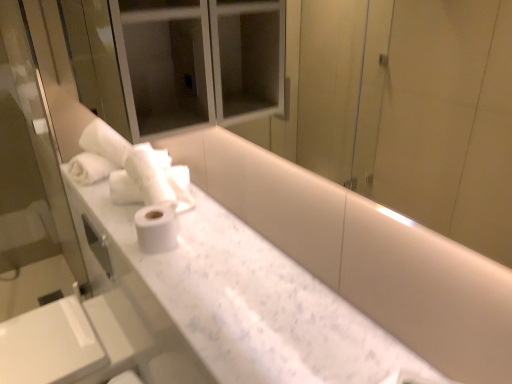
Question: Should I look upward or downward to see white marble counter at center?

Choices:
 (A) up
 (B) down

Answer: (B)

Question: Does white matte toilet paper at center have a larger size compared to white soft towel at upper left?

Choices:
 (A) no
 (B) yes

Answer: (A)

Question: Does white matte toilet paper at center turn towards white soft towel at upper left?

Choices:
 (A) yes
 (B) no

Answer: (B)

Question: From the image's perspective, is white matte toilet paper at center on top of white soft towel at upper left?

Choices:
 (A) no
 (B) yes

Answer: (A)

Question: From a real-world perspective, is white matte toilet paper at center on top of white soft towel at upper left?

Choices:
 (A) yes
 (B) no

Answer: (B)

Question: Considering the relative positions of white matte toilet paper at center and white soft towel at upper left in the image provided, is white matte toilet paper at center to the left of white soft towel at upper left from the viewer's perspective?

Choices:
 (A) yes
 (B) no

Answer: (B)

Question: From the image's perspective, is white matte toilet paper at center beneath white soft towel at upper left?

Choices:
 (A) yes
 (B) no

Answer: (A)

Question: Are white marble sink at lower left and white marble counter at center located far from each other?

Choices:
 (A) yes
 (B) no

Answer: (B)

Question: Is white marble sink at lower left behind white marble counter at center?

Choices:
 (A) no
 (B) yes

Answer: (B)

Question: Can you confirm if white marble sink at lower left is positioned to the left of white marble counter at center?

Choices:
 (A) yes
 (B) no

Answer: (A)

Question: Considering the relative sizes of white marble sink at lower left and white marble counter at center in the image provided, is white marble sink at lower left wider than white marble counter at center?

Choices:
 (A) yes
 (B) no

Answer: (A)

Question: Can we say white marble sink at lower left lies outside white marble counter at center?

Choices:
 (A) no
 (B) yes

Answer: (B)

Question: From the image's perspective, is white marble sink at lower left over white marble counter at center?

Choices:
 (A) no
 (B) yes

Answer: (A)

Question: Does white soft towel at upper left have a greater width compared to white matte toilet paper at center?

Choices:
 (A) no
 (B) yes

Answer: (B)